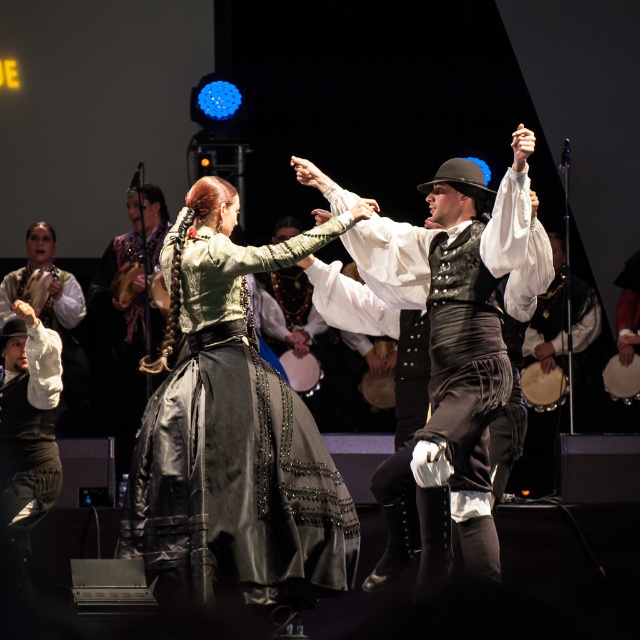
Question: Which object is closer to the camera taking this photo?

Choices:
 (A) shiny black vest at center
 (B) smooth brown drum at center

Answer: (A)

Question: Is satin black dress at center smaller than wooden tambourine at center?

Choices:
 (A) no
 (B) yes

Answer: (A)

Question: Does white leather drum at right come in front of smooth beige drum at lower right?

Choices:
 (A) yes
 (B) no

Answer: (A)

Question: Does smooth wooden tambourine at center have a greater width compared to smooth brown drum at center?

Choices:
 (A) no
 (B) yes

Answer: (A)

Question: Which object is the closest to the smooth wooden tambourine at center?

Choices:
 (A) white leather drum at right
 (B) satin black dress at center

Answer: (A)

Question: Among these objects, which one is farthest from the camera?

Choices:
 (A) wooden tambourine at center
 (B) smooth brown drum at center
 (C) smooth wooden tambourine at center

Answer: (A)